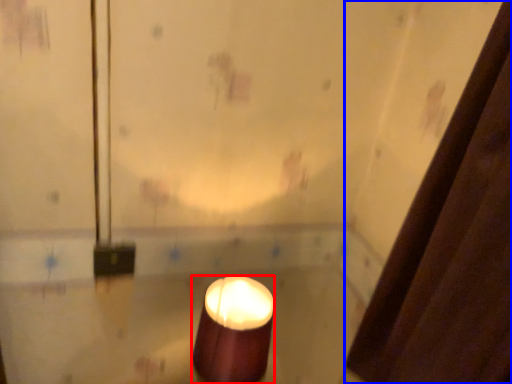
Question: Which of the following is the closest to the observer, candle (highlighted by a red box) or shower curtain (highlighted by a blue box)?

Choices:
 (A) candle
 (B) shower curtain

Answer: (B)